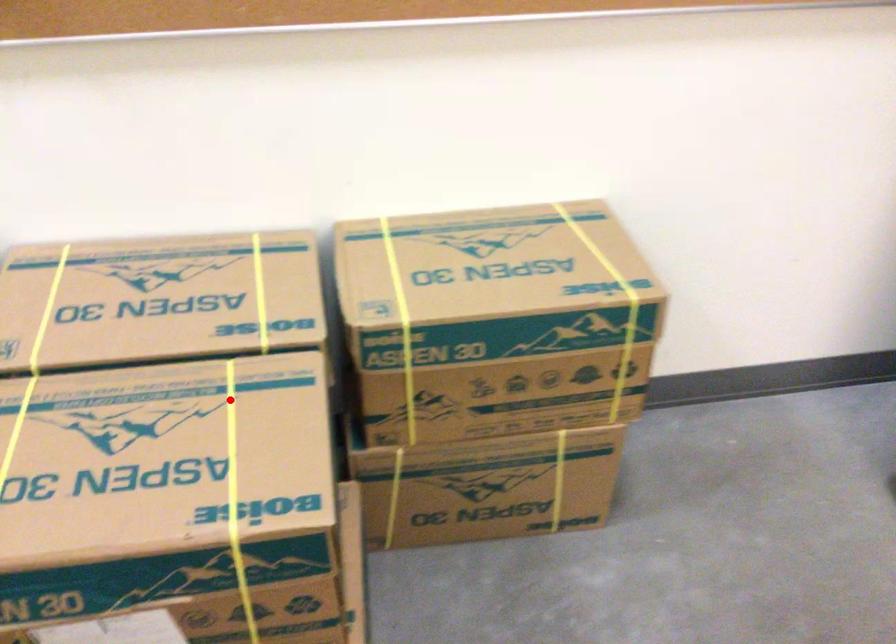
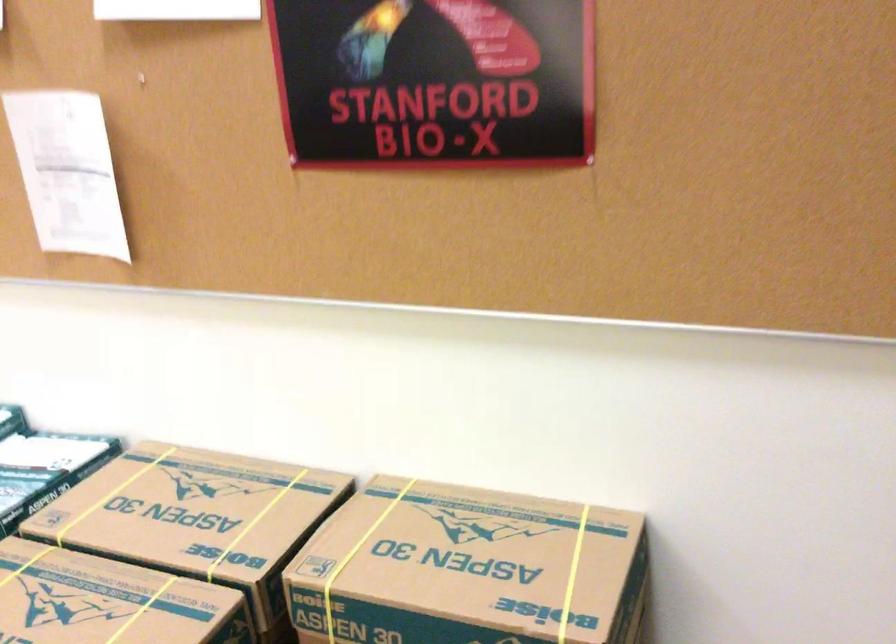
Question: I am providing you with two images of the same scene from different viewpoints. Image1 has a red point marked. In image2, the corresponding 3D location appears at what relative position? Reply with the corresponding letter.

Choices:
 (A) Closer
 (B) Farther

Answer: (B)